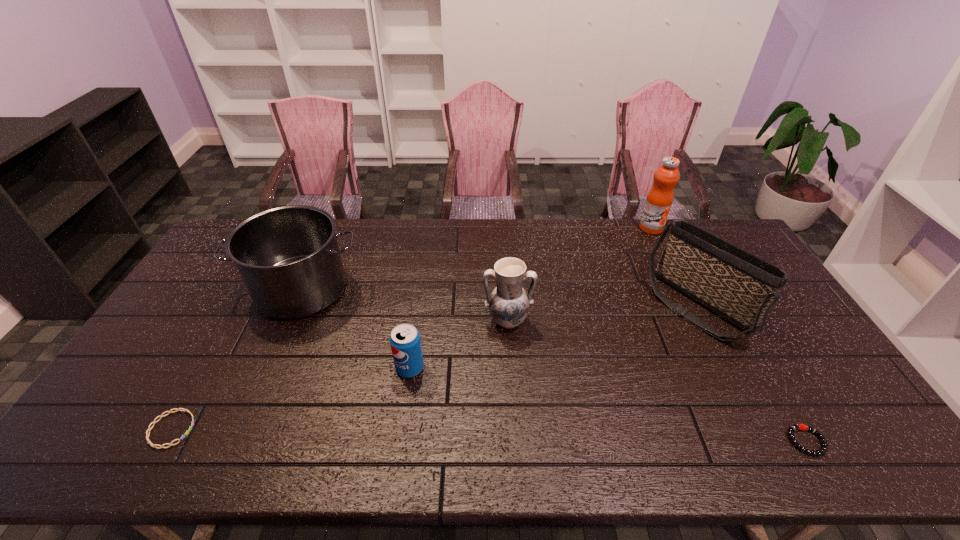
This screenshot has width=960, height=540. Identify the location of empty location between the fourth object from right to left and the left bracelet. (340, 375).

Find the location of a particular element. vacant space that is in between the soda can and the handbag is located at coordinates pos(555,338).

Find the location of a particular element. empty location between the left bracelet and the pottery is located at coordinates (340, 375).

This screenshot has width=960, height=540. Find the location of `free space between the handbag and the third object from left to right`. free space between the handbag and the third object from left to right is located at coordinates (555, 338).

Locate an element on the screen. This screenshot has height=540, width=960. the fifth closest object to the left bracelet is located at coordinates (794, 427).

Select which object appears as the sixth closest to the right bracelet. Please provide its 2D coordinates. Your answer should be formatted as a tuple, i.e. [(x, y)], where the tuple contains the x and y coordinates of a point satisfying the conditions above.

[(185, 410)]

Find the location of a particular element. free location that satisfies the following two spatial constraints: 1. on the front side of the right bracelet; 2. on the left side of the third nearest object is located at coordinates (399, 441).